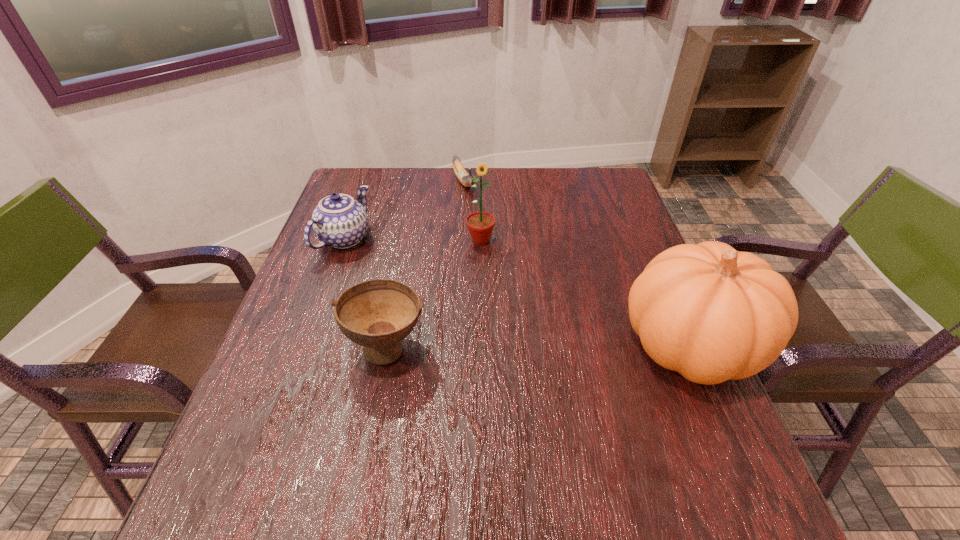
I want to click on blank area in the image that satisfies the following two spatial constraints: 1. on the back side of the banana; 2. on the right side of the chinaware, so click(x=366, y=182).